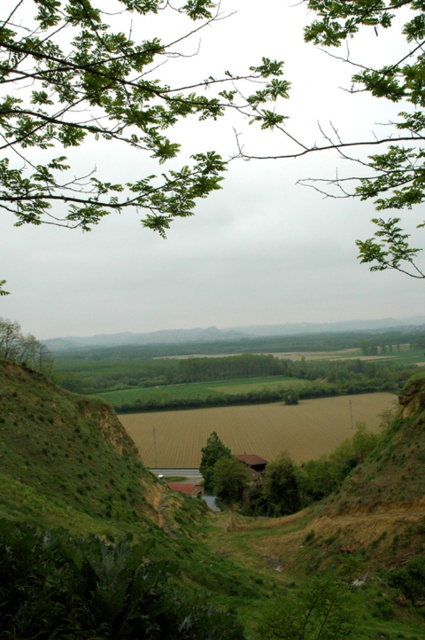
You are standing at a high vantage point overlooking the rural landscape. You notice two points marked in the scene. The first point is at coordinates point (17, 336), and the second is at point (207, 464). Which of these two points is closer to your current position?

Point (17, 336) is in front of point (207, 464), so it is closer to your current position.

You are an architect designing a new garden and want to incorporate both the green leafy tree at left and the green matte tree at center. Based on their sizes in the image, which tree would you place closer to the entrance to create a grand entrance, and why?

The green leafy tree at left has a larger width than the green matte tree at center, so placing it closer to the entrance would create a grander appearance due to its larger size.

You are an environmental scientist assessing the biodiversity of this rural landscape. You observe the green leafy tree at left and the green matte tree at center. Which tree would you prioritize for further study if you are interested in understanding the dominant tree species in this area?

The green leafy tree at left is larger in size than the green matte tree at center, so it might be the dominant species and should be prioritized for study.